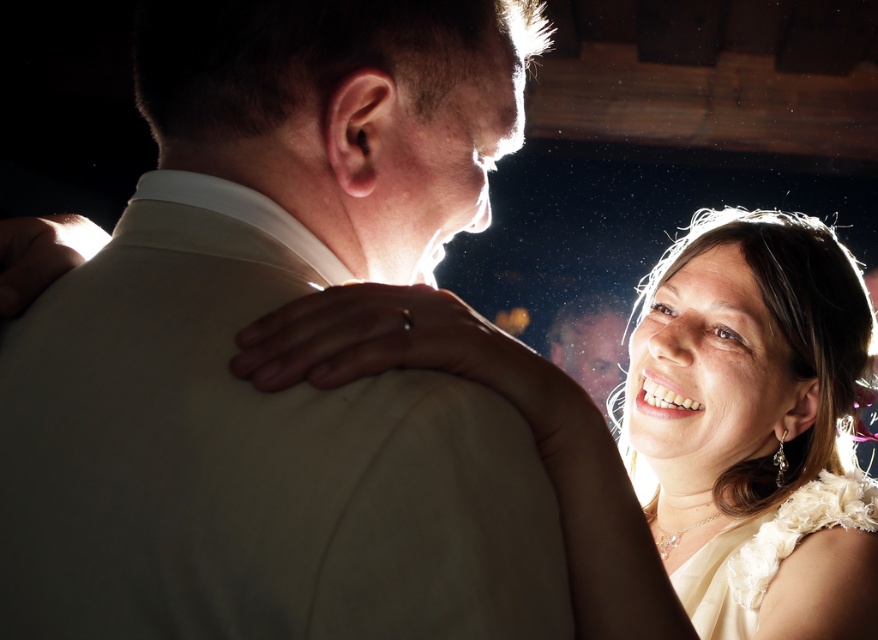
Is matte white suit at center to the right of white satin dress at center from the viewer's perspective?

In fact, matte white suit at center is to the left of white satin dress at center.

At what (x,y) coordinates should I click in order to perform the action: click on matte white suit at center. Please return your answer as a coordinate pair (x, y). The image size is (878, 640). Looking at the image, I should click on (258, 316).

Find the location of a particular element. matte white suit at center is located at coordinates (258, 316).